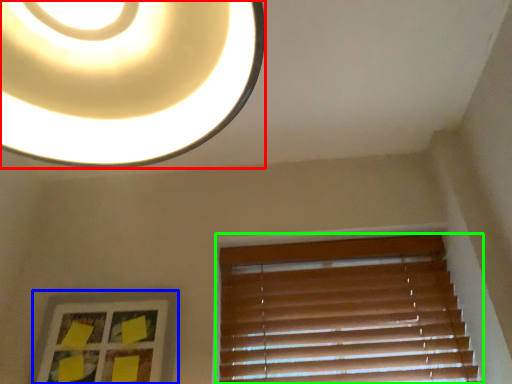
Question: Which is nearer to the lamp (highlighted by a red box)? picture frame (highlighted by a blue box) or window blind (highlighted by a green box).

Choices:
 (A) picture frame
 (B) window blind

Answer: (A)